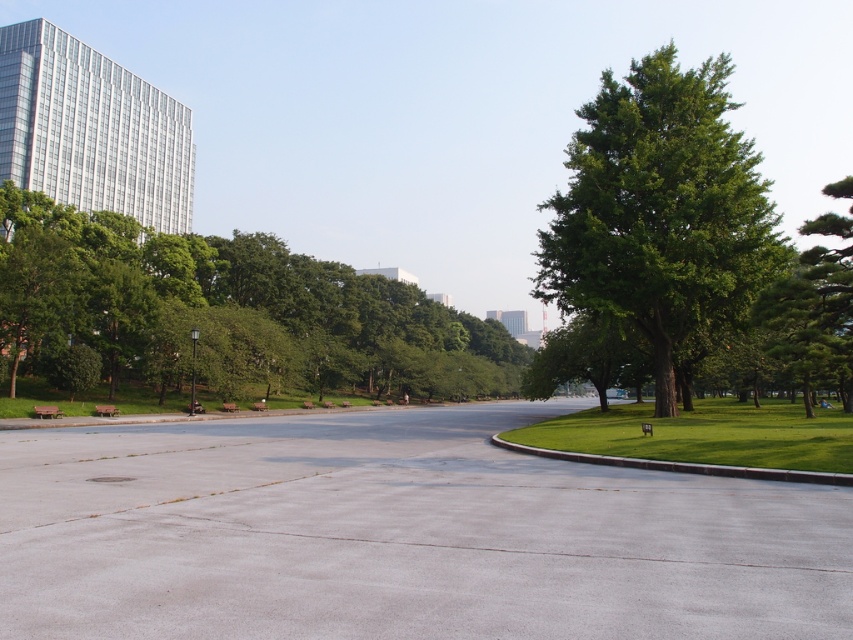
You are standing in the middle of the park and want to walk towards the green leafy tree at left and the green leafy tree at right. Which direction should you face to walk towards both trees?

To walk towards both the green leafy tree at left and the green leafy tree at right, you should face the direction between them since the green leafy tree at left is positioned on the left side of the green leafy tree at right.

You are planning to install a new bench in the park. The bench requires a shaded area that is at least 3 meters wide. Based on the image, which tree between the green leafy tree at left and the green leafy tree at right would provide a wider shaded area?

The green leafy tree at right is taller than the green leafy tree at left, so it likely provides a wider shaded area. Therefore, the bench should be placed under the green leafy tree at right to meet the 3 meters width requirement.

You are standing at the center of the park and want to find the green leafy tree at left. Based on the coordinates provided, in which direction should you walk to reach it?

The green leafy tree at left is located at coordinates (228, 310). Since the coordinate system is normalized, with the origin at the bottom left corner of the image, the tree is positioned to the right and slightly above the center point. Therefore, you should walk towards the right and slightly forward to reach it.